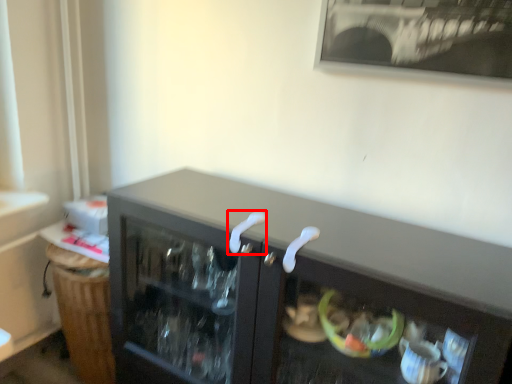
Question: From the image's perspective, what is the correct spatial relationship of door handle (annotated by the red box) in relation to door handle?

Choices:
 (A) above
 (B) below

Answer: (A)